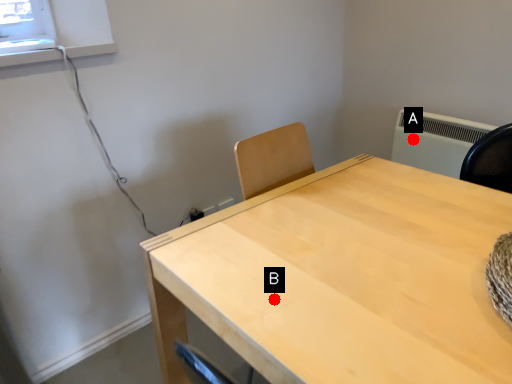
Question: Two points are circled on the image, labeled by A and B beside each circle. Which point is farther from the camera taking this photo?

Choices:
 (A) A is further
 (B) B is further

Answer: (A)